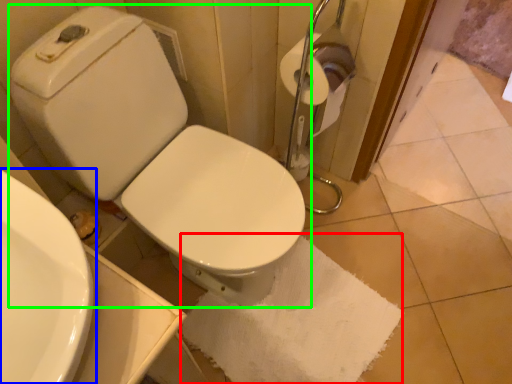
Question: Considering the real-world distances, which object is closest to bath towel (highlighted by a red box)? sink (highlighted by a blue box) or toilet (highlighted by a green box).

Choices:
 (A) sink
 (B) toilet

Answer: (B)